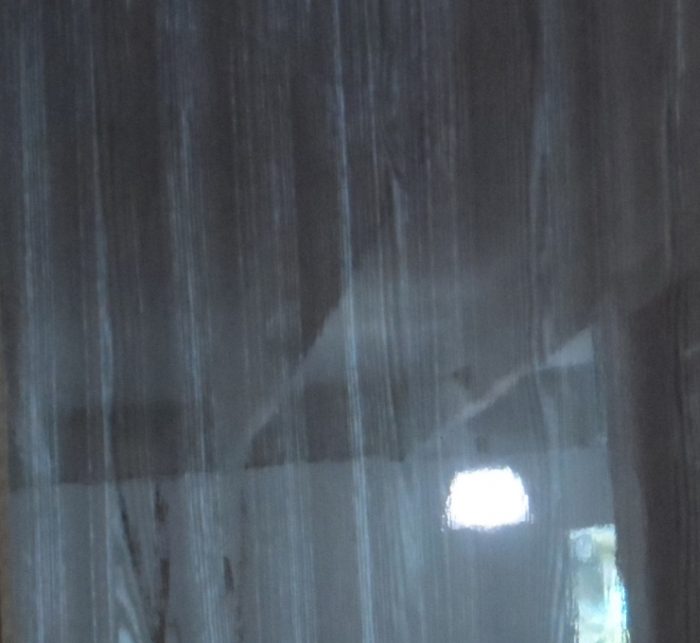
Identify the location of wall above open door. (589, 490).